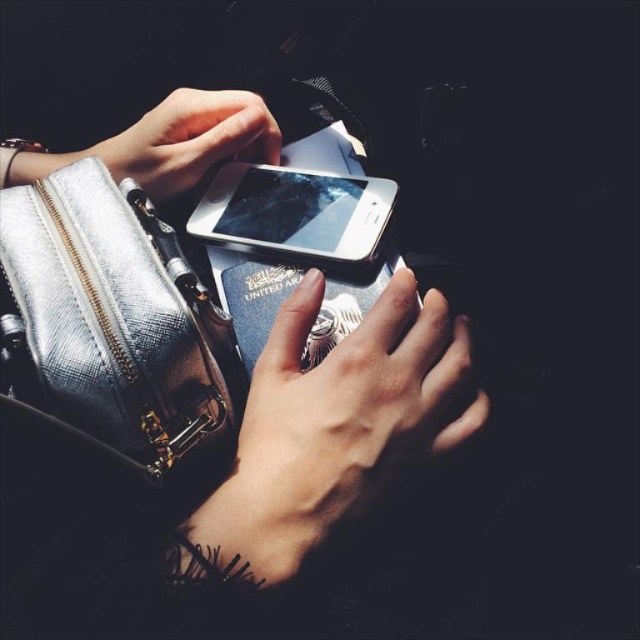
Question: Which object is closer to the camera taking this photo?

Choices:
 (A) matte black phone at upper center
 (B) shiny silver phone at center

Answer: (B)

Question: Can you confirm if metallic silver handbag at left is thinner than shiny silver phone at center?

Choices:
 (A) yes
 (B) no

Answer: (A)

Question: Which point is closer to the camera?

Choices:
 (A) (179, 147)
 (B) (349, 497)
 (C) (29, 394)
 (D) (392, 362)

Answer: (C)

Question: Which point appears closest to the camera in this image?

Choices:
 (A) (248, 113)
 (B) (115, 192)
 (C) (387, 385)

Answer: (C)

Question: Is metallic silver handbag at left to the left of shiny silver phone at center from the viewer's perspective?

Choices:
 (A) no
 (B) yes

Answer: (B)

Question: Is metallic silver handbag at left positioned in front of matte black phone at upper center?

Choices:
 (A) no
 (B) yes

Answer: (B)